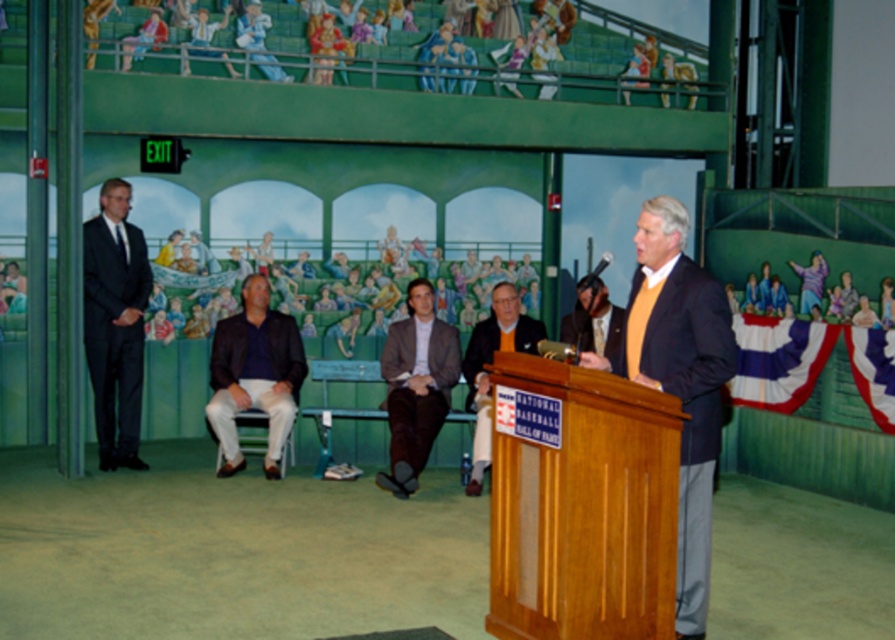
Who is positioned more to the left, dark gray suit at left or dark blue shirt at center?

From the viewer's perspective, dark gray suit at left appears more on the left side.

Does dark gray suit at left appear over dark blue shirt at center?

Yes.

Image resolution: width=895 pixels, height=640 pixels. I want to click on dark gray suit at left, so [115, 323].

Where is `dark gray suit at left`? dark gray suit at left is located at coordinates (115, 323).

The width and height of the screenshot is (895, 640). What do you see at coordinates (490, 362) in the screenshot?
I see `matte orange sweater at center` at bounding box center [490, 362].

Is matte orange sweater at center positioned in front of matte black suit at center?

No, matte orange sweater at center is further to the viewer.

Between point (501, 326) and point (578, 296), which one is positioned behind?

Point (578, 296)

Find the location of a particular element. The width and height of the screenshot is (895, 640). matte orange sweater at center is located at coordinates (490, 362).

Is orange sweater at center bigger than dark gray suit at left?

Actually, orange sweater at center might be smaller than dark gray suit at left.

Between point (688, 352) and point (107, 435), which one is positioned behind?

Point (107, 435)

Where is `orange sweater at center`? The height and width of the screenshot is (640, 895). orange sweater at center is located at coordinates (680, 380).